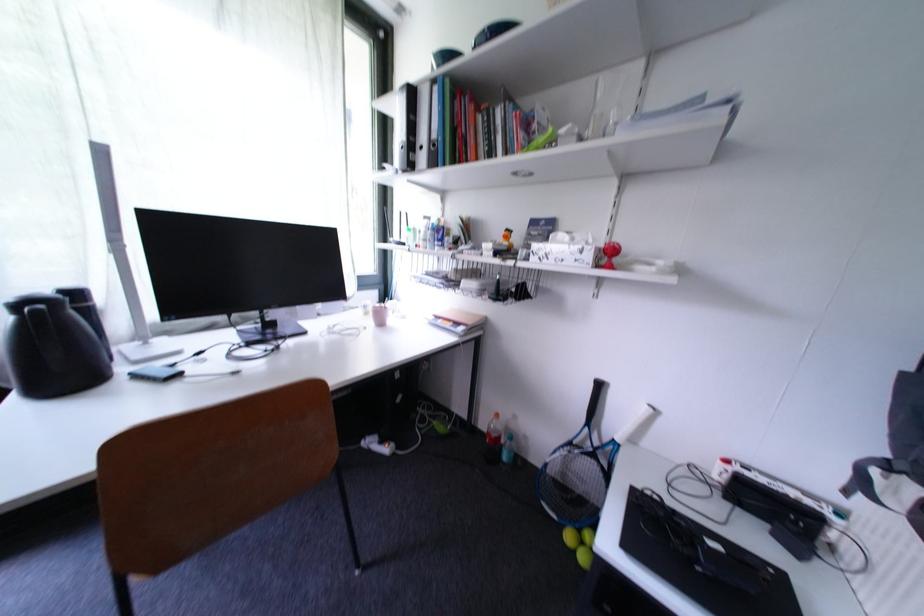
What are the coordinates of `drinking glass` in the screenshot? It's located at (604, 105).